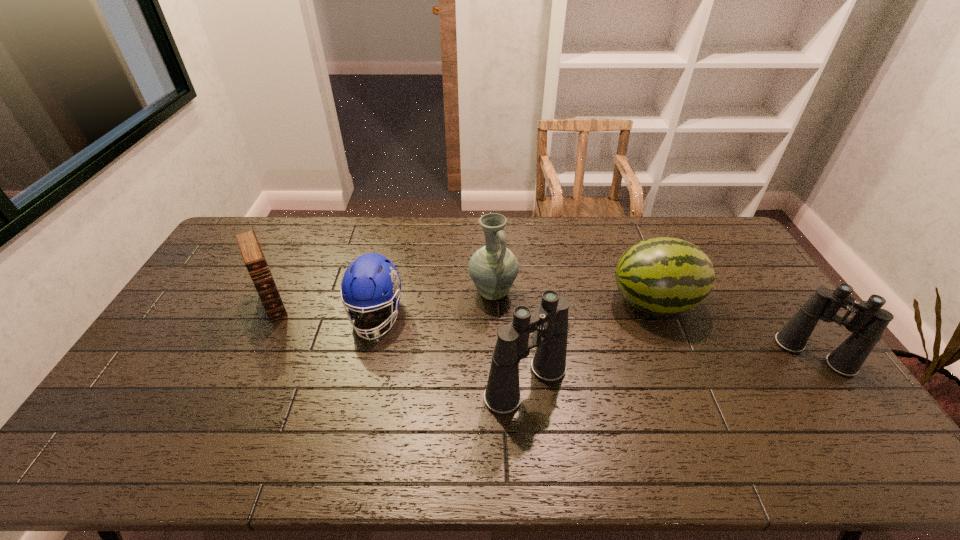
You are a GUI agent. You are given a task and a screenshot of the screen. Output one action in this format:
    pyautogui.click(x=<x>, y=<y>)
    Task: Click on the left binoculars
    
    Given the screenshot: What is the action you would take?
    pyautogui.click(x=549, y=323)

You are a GUI agent. You are given a task and a screenshot of the screen. Output one action in this format:
    pyautogui.click(x=<x>, y=<y>)
    Task: Click on the rightmost object
    
    Given the screenshot: What is the action you would take?
    pyautogui.click(x=868, y=324)

Identify the location of the right binoculars. This screenshot has height=540, width=960. (868, 324).

The image size is (960, 540). What are the coordinates of `watermelon` in the screenshot? It's located at (663, 275).

Identify the location of football helmet. (364, 281).

At what (x,y) coordinates should I click in order to perform the action: click on pitcher. Please return your answer as a coordinate pair (x, y). Looking at the image, I should click on (493, 268).

Where is `the leftmost object`? The image size is (960, 540). the leftmost object is located at coordinates (252, 254).

Locate an element on the screen. Image resolution: width=960 pixels, height=540 pixels. free region located on the back of the taller binoculars is located at coordinates (521, 328).

Locate an element on the screen. This screenshot has width=960, height=540. vacant region located 0.090m on the left of the right binoculars is located at coordinates (752, 355).

Find the location of a particular element. The image size is (960, 540). vacant space located 0.060m at the stem end of the watermelon is located at coordinates (591, 302).